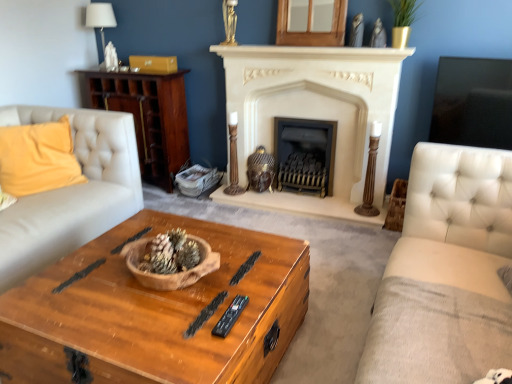
At what (x,y) coordinates should I click in order to perform the action: click on free space in front of black plastic remote at center. Please return your answer as a coordinate pair (x, y). The height and width of the screenshot is (384, 512). Looking at the image, I should click on tap(214, 345).